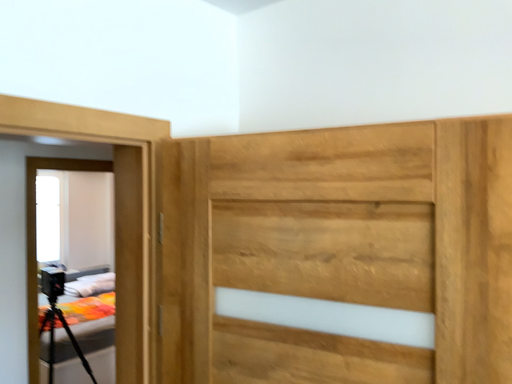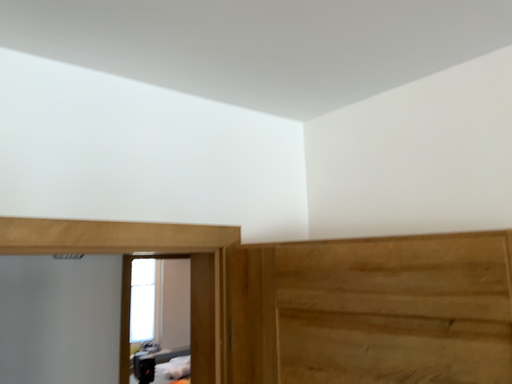
Question: Which way did the camera rotate in the video?

Choices:
 (A) rotated right
 (B) rotated left

Answer: (B)